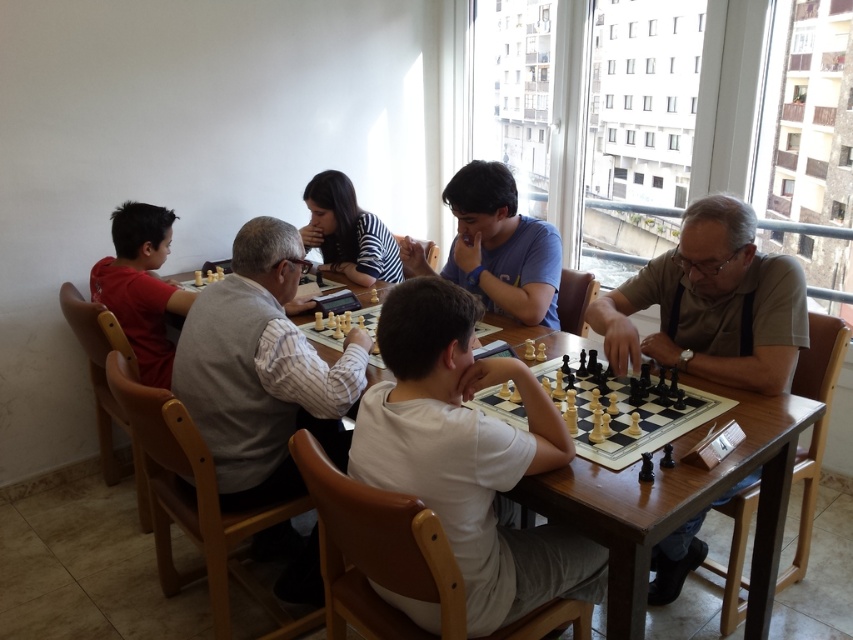
You are a photographer standing behind the table and want to take a photo of the matte beige shirt at center and the striped fabric shirt at center. Which one will be closer to the camera in the photo?

The matte beige shirt at center is in front of the striped fabric shirt at center, so it will be closer to the camera in the photo.

You are standing in the room and want to pick up an object located at point (701, 374). The object is 6.45 feet away from you. If your arm can reach up to 6 feet, can you reach it without moving closer?

The point (701, 374) is 6.45 feet away from you, which is beyond your arm reach of 6 feet. You need to move closer to reach it.